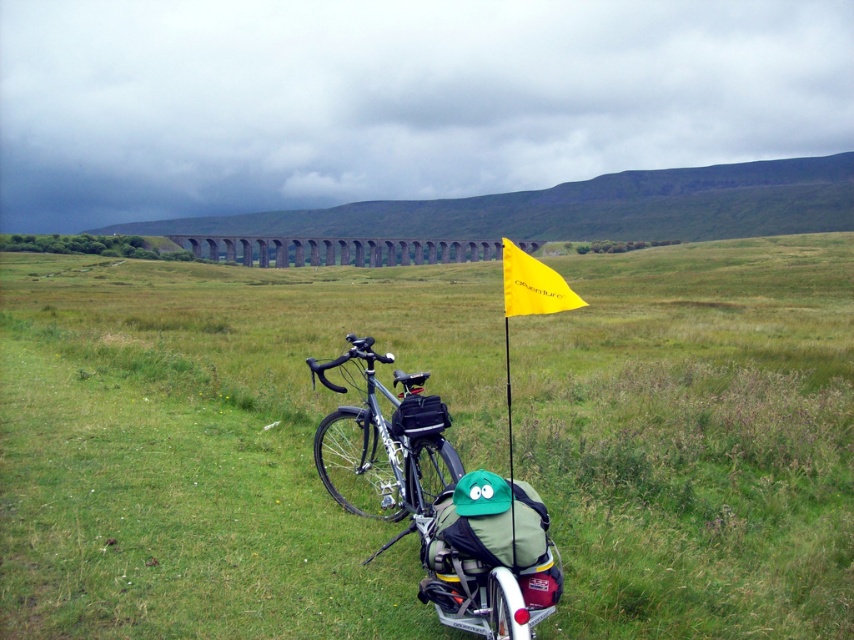
Question: Is shiny metallic bicycle at center thinner than gray concrete viaduct at center?

Choices:
 (A) yes
 (B) no

Answer: (A)

Question: Which of the following is the closest to the observer?

Choices:
 (A) silver metallic bicycle at center
 (B) green grassy field at center

Answer: (A)

Question: Is silver metallic bicycle at center to the left of yellow fabric flag at center from the viewer's perspective?

Choices:
 (A) no
 (B) yes

Answer: (B)

Question: Is silver metallic bicycle at center to the left of shiny metallic bicycle at center from the viewer's perspective?

Choices:
 (A) no
 (B) yes

Answer: (A)

Question: Which object is the farthest from the silver metallic bicycle at center?

Choices:
 (A) yellow fabric flag at center
 (B) green grassy field at center

Answer: (B)

Question: Which point is closer to the camera?

Choices:
 (A) gray concrete viaduct at center
 (B) green grassy field at center
 (C) yellow fabric flag at center
 (D) shiny metallic bicycle at center

Answer: (C)